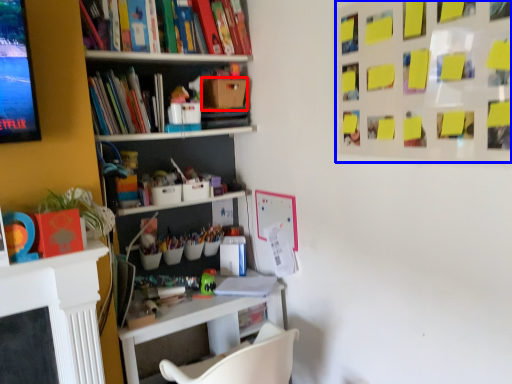
Question: Among these objects, which one is nearest to the camera, cardboard box (highlighted by a red box) or bulletin board (highlighted by a blue box)?

Choices:
 (A) cardboard box
 (B) bulletin board

Answer: (B)